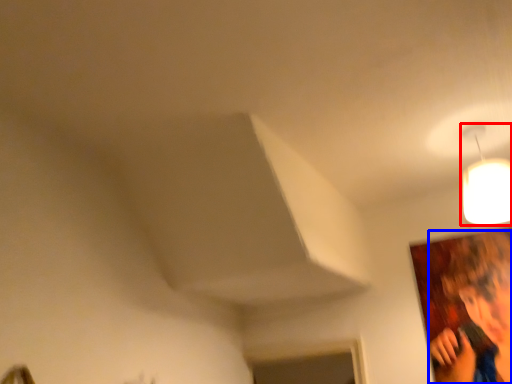
Question: Which of the following is the closest to the observer, lamp (highlighted by a red box) or person (highlighted by a blue box)?

Choices:
 (A) lamp
 (B) person

Answer: (A)